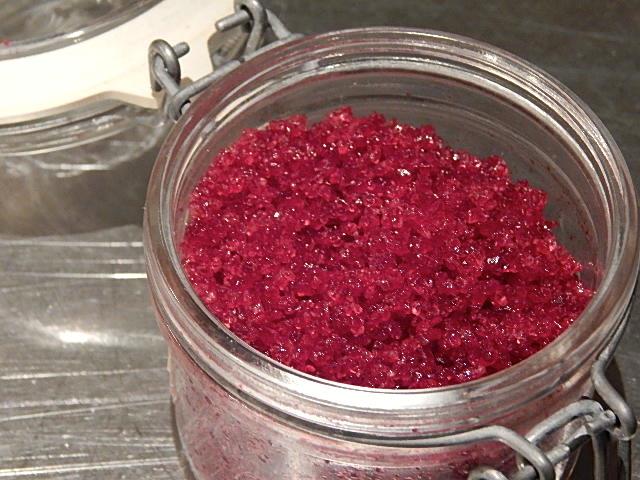
The width and height of the screenshot is (640, 480). I want to click on table top, so click(x=90, y=374).